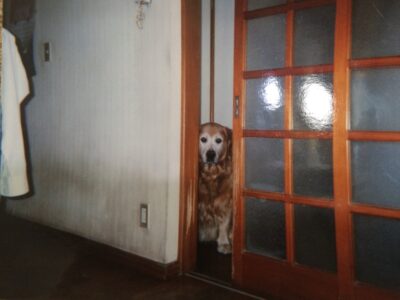
This screenshot has height=300, width=400. Find the location of `white wall`. white wall is located at coordinates (98, 111).